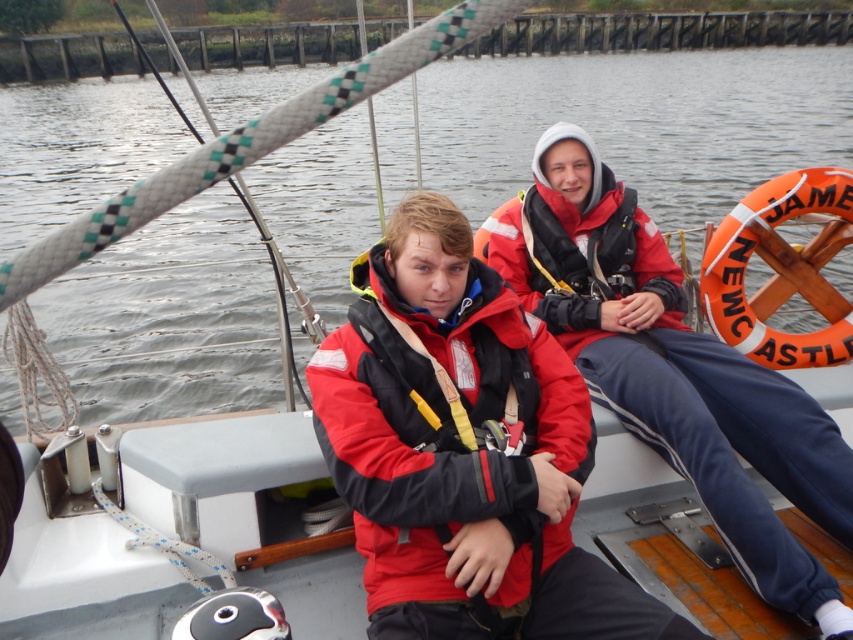
Question: Among these objects, which one is farthest from the camera?

Choices:
 (A) red matte life jacket at center
 (B) red matte jacket at right
 (C) red matte life jacket at upper right

Answer: (C)

Question: Which point is farther to the camera?

Choices:
 (A) (585, 404)
 (B) (590, 369)

Answer: (B)

Question: Is red matte jacket at right to the left of red matte life jacket at upper right from the viewer's perspective?

Choices:
 (A) yes
 (B) no

Answer: (B)

Question: Can you confirm if red matte jacket at right is positioned to the right of red matte life jacket at center?

Choices:
 (A) no
 (B) yes

Answer: (B)

Question: Which object is farther from the camera taking this photo?

Choices:
 (A) red matte jacket at right
 (B) red matte life jacket at center

Answer: (A)

Question: Is red matte life jacket at center wider than red matte life jacket at upper right?

Choices:
 (A) yes
 (B) no

Answer: (B)